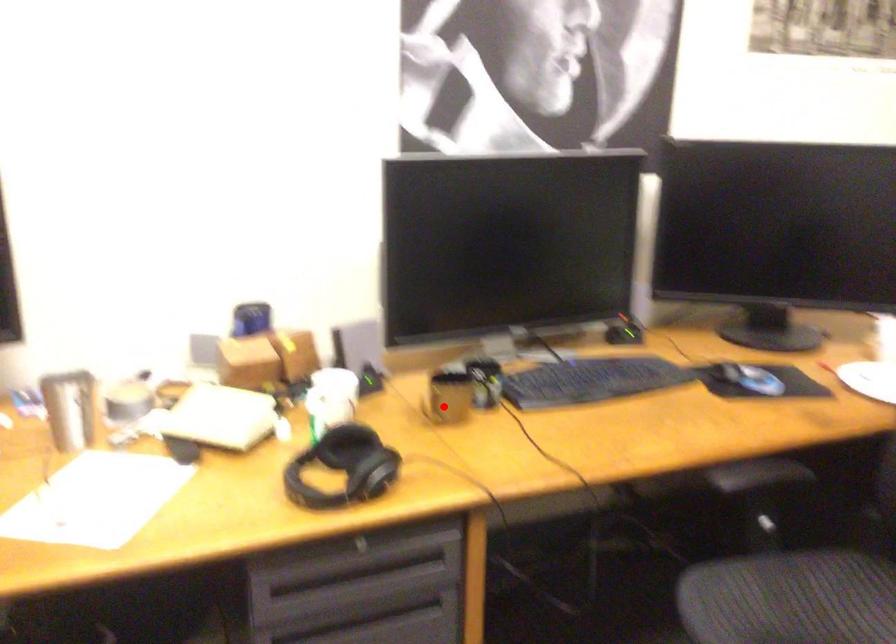
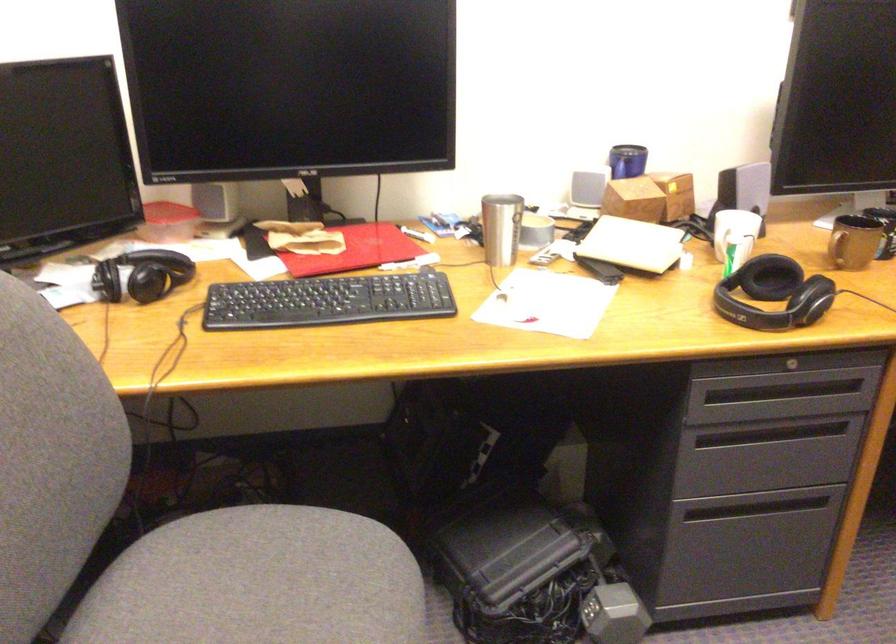
In the second image, find the point that corresponds to the highlighted location in the first image.

(854, 242)